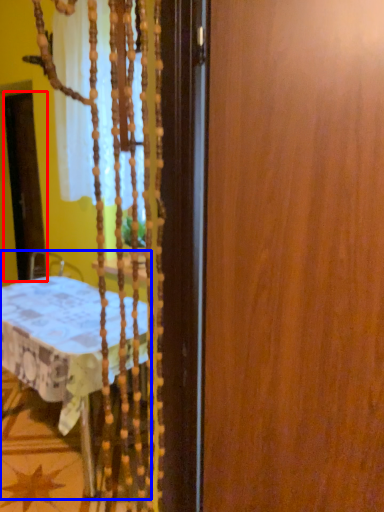
Question: Which point is closer to the camera, screen door (highlighted by a red box) or furniture (highlighted by a blue box)?

Choices:
 (A) screen door
 (B) furniture

Answer: (B)